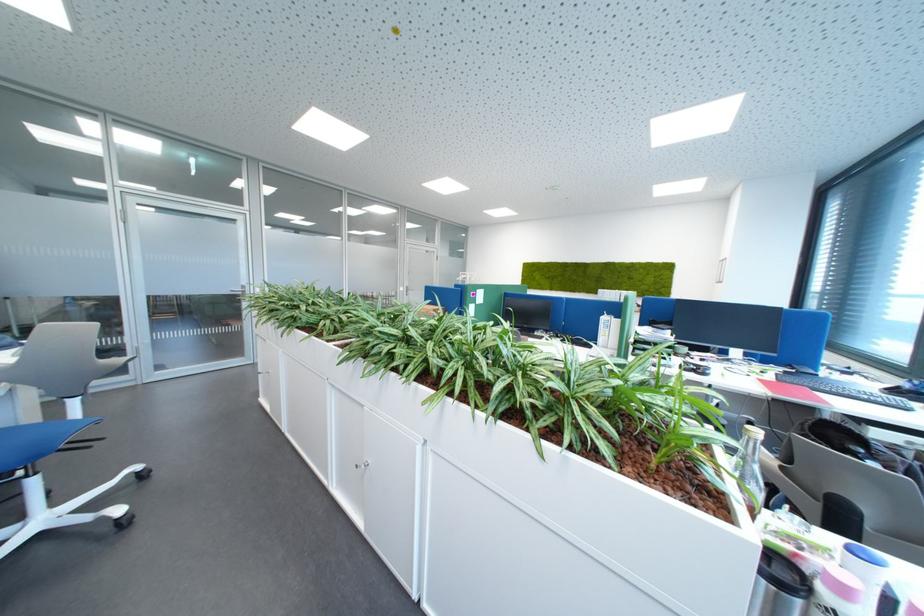
The location [749,468] corresponds to which object?

It corresponds to the metal water bottle in the image.